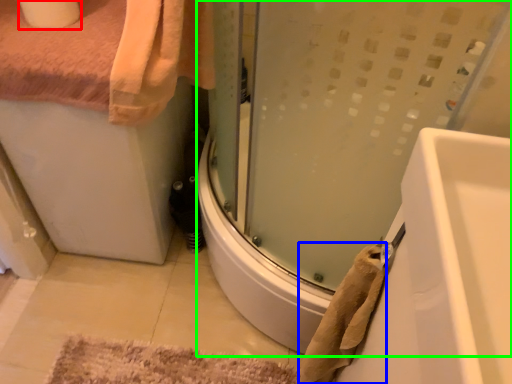
Question: Which is nearer to the toilet paper (highlighted by a red box)? bath towel (highlighted by a blue box) or shower door (highlighted by a green box).

Choices:
 (A) bath towel
 (B) shower door

Answer: (B)